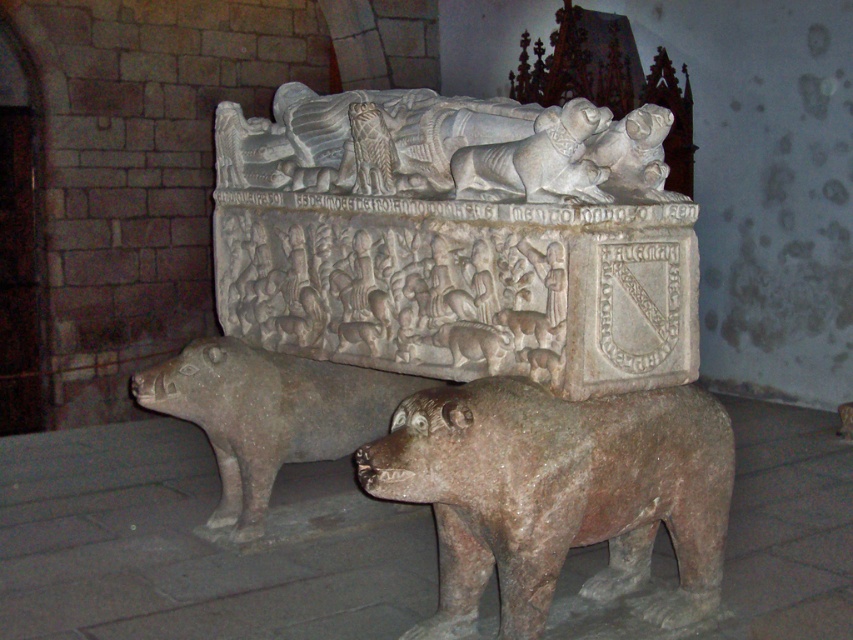
Question: Where is rustic stone pig at lower center located in relation to gray stone pig at center in the image?

Choices:
 (A) left
 (B) right

Answer: (B)

Question: Can you confirm if rustic stone pig at lower left is positioned to the left of gray stone pig at center?

Choices:
 (A) no
 (B) yes

Answer: (B)

Question: Which object is the closest to the rustic stone pig at lower left?

Choices:
 (A) rustic stone pig at lower center
 (B) gray stone pig at center

Answer: (A)

Question: Which point appears farthest from the camera in this image?

Choices:
 (A) (466, 180)
 (B) (618, 528)

Answer: (A)

Question: Is rustic stone pig at lower center smaller than gray stone pig at center?

Choices:
 (A) no
 (B) yes

Answer: (A)

Question: Which point is closer to the camera?

Choices:
 (A) rustic stone pig at lower left
 (B) rustic stone pig at lower center
 (C) gray stone pig at center

Answer: (B)